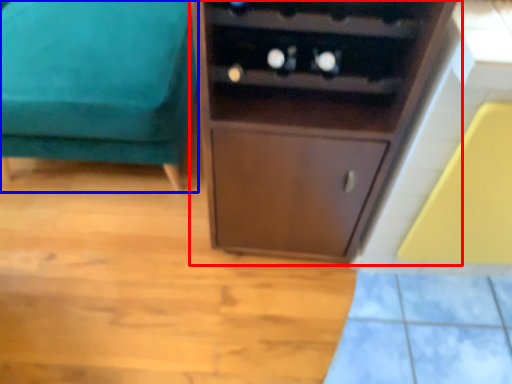
Question: Which object appears closest to the camera in this image, cupboard (highlighted by a red box) or furniture (highlighted by a blue box)?

Choices:
 (A) cupboard
 (B) furniture

Answer: (A)